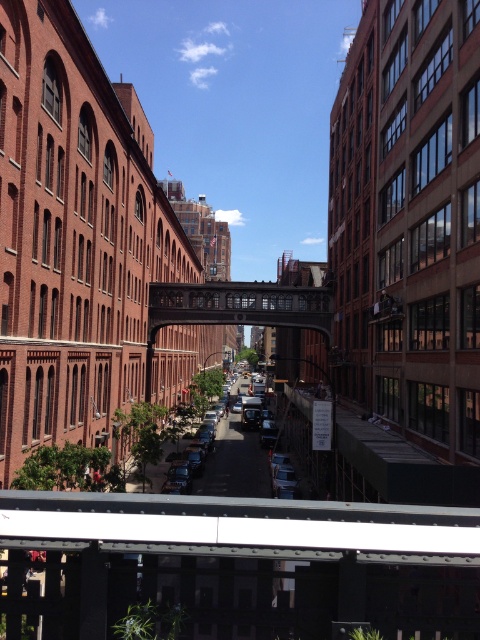
You are a delivery person trying to drive your shiny silver sedan at center under the rustic metal bridge at center. Based on the scene, can your sedan pass under the bridge without hitting it?

The rustic metal bridge at center has a greater height compared to shiny silver sedan at center. Since the bridge is taller than the sedan, the sedan can safely pass under the bridge without hitting it.

You are a delivery person needing to deliver a package to the shiny silver sedan at center. The delivery robot you are using has a maximum range of 15 meters. Can the robot reach the sedan from the rustic metal bridge at center?

The distance between the rustic metal bridge at center and the shiny silver sedan at center is 14.22 meters, which is within the robot s 15 meter range. Therefore, the robot can reach the sedan.

You are standing at the metal railing in the foreground of the image. You want to cross the street to the building on the opposite side. Which object at point (239, 305) can help you cross the street?

The rustic metal bridge at center located at point (239, 305) can help you cross the street.